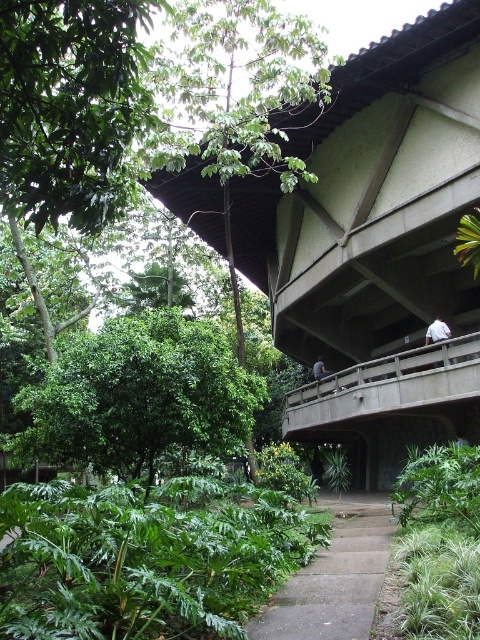
You are a hiker who wants to take a photo of the gray concrete path at center and the white fabric shirt at upper right. Which object should you focus on first if you want to capture both in a single frame without moving the camera?

The gray concrete path at center is taller than the white fabric shirt at upper right, so you should focus on the gray concrete path at center first to ensure both are in focus.

You are standing at the point marked by the coordinates point [335,579]. Based on the scene description, what is the object located at those coordinates?

The point [335,579] corresponds to the gray concrete path at center according to the objects description.